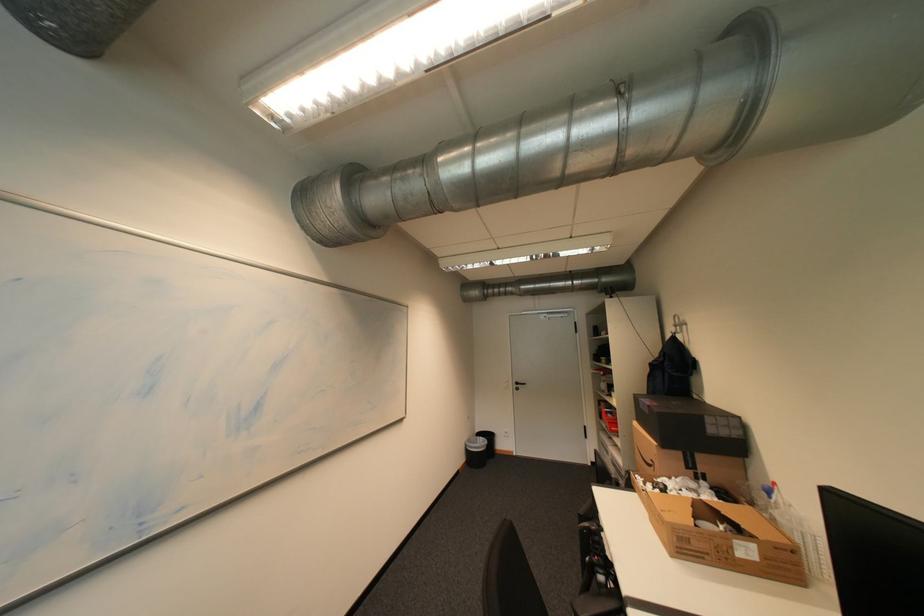
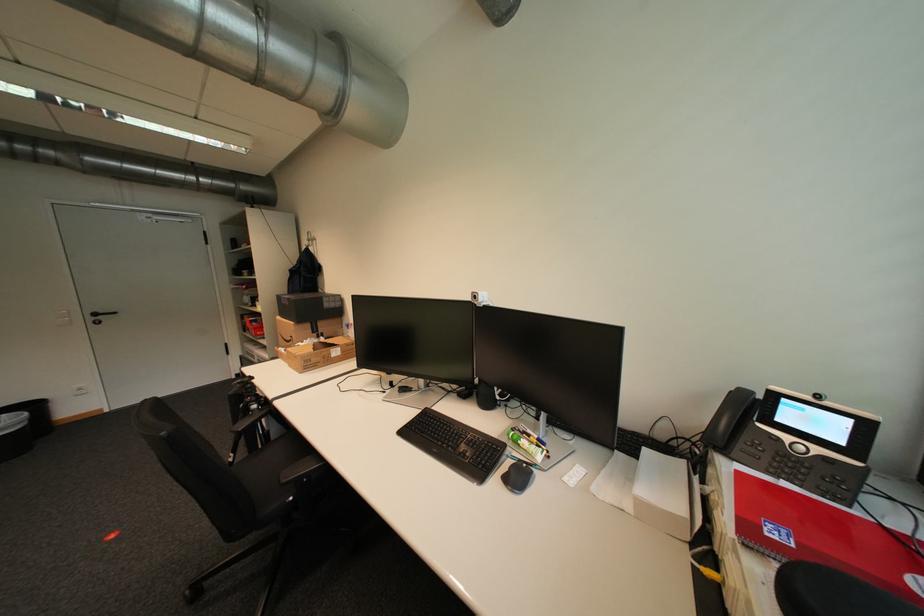
Where in the second image is the point corresponding to point (699, 551) from the first image?

(319, 365)